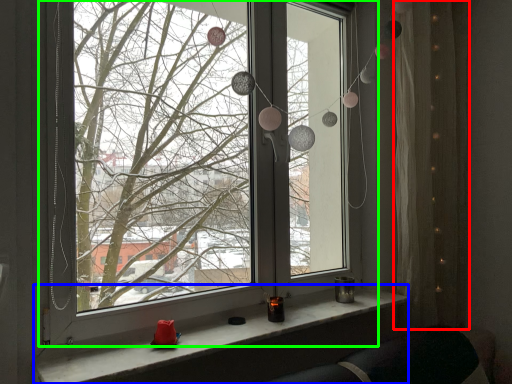
Question: Based on their relative distances, which object is nearer to curtain (highlighted by a red box)? Choose from window sill (highlighted by a blue box) and window (highlighted by a green box).

Choices:
 (A) window sill
 (B) window

Answer: (A)